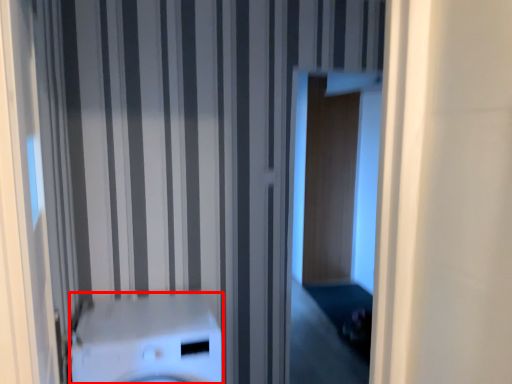
Question: Considering the relative positions of washer (annotated by the red box) and screen door in the image provided, where is washer (annotated by the red box) located with respect to the staircase?

Choices:
 (A) right
 (B) left

Answer: (B)